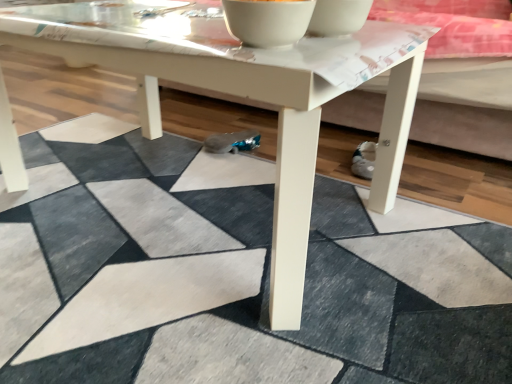
Question: From a real-world perspective, is white glossy bowl at upper center, the first bowl from the left, located higher than white glossy bowl at upper center, which ranks as the 2th bowl in left-to-right order?

Choices:
 (A) yes
 (B) no

Answer: (A)

Question: Is white glossy bowl at upper center, the first bowl from the left, wider than white glossy bowl at upper center, which ranks as the 2th bowl in left-to-right order?

Choices:
 (A) no
 (B) yes

Answer: (B)

Question: Is white glossy bowl at upper center, acting as the second bowl starting from the right, oriented away from white glossy bowl at upper center, the first bowl in the right-to-left sequence?

Choices:
 (A) yes
 (B) no

Answer: (B)

Question: Is white glossy bowl at upper center, acting as the second bowl starting from the right, positioned before white glossy bowl at upper center, the first bowl in the right-to-left sequence?

Choices:
 (A) yes
 (B) no

Answer: (A)

Question: Is white glossy bowl at upper center, acting as the second bowl starting from the right, shorter than white glossy bowl at upper center, which ranks as the 2th bowl in left-to-right order?

Choices:
 (A) yes
 (B) no

Answer: (B)

Question: Considering the relative positions of white glossy bowl at upper center, acting as the second bowl starting from the right, and white glossy bowl at upper center, which ranks as the 2th bowl in left-to-right order, in the image provided, is white glossy bowl at upper center, acting as the second bowl starting from the right, to the left of white glossy bowl at upper center, which ranks as the 2th bowl in left-to-right order, from the viewer's perspective?

Choices:
 (A) no
 (B) yes

Answer: (B)

Question: Is white glossy bowl at upper center, acting as the second bowl starting from the right, located within white glossy bowl at upper center, the first bowl in the right-to-left sequence?

Choices:
 (A) no
 (B) yes

Answer: (A)

Question: Does white glossy bowl at upper center, the first bowl in the right-to-left sequence, have a lesser width compared to white glossy bowl at upper center, acting as the second bowl starting from the right?

Choices:
 (A) yes
 (B) no

Answer: (A)

Question: From the image's perspective, is white glossy bowl at upper center, which ranks as the 2th bowl in left-to-right order, below white glossy bowl at upper center, acting as the second bowl starting from the right?

Choices:
 (A) no
 (B) yes

Answer: (A)

Question: Can you confirm if white glossy bowl at upper center, which ranks as the 2th bowl in left-to-right order, is positioned to the left of white glossy bowl at upper center, the first bowl from the left?

Choices:
 (A) no
 (B) yes

Answer: (A)

Question: From a real-world perspective, is white glossy bowl at upper center, the first bowl in the right-to-left sequence, on top of white glossy bowl at upper center, acting as the second bowl starting from the right?

Choices:
 (A) yes
 (B) no

Answer: (B)

Question: From a real-world perspective, is white glossy bowl at upper center, which ranks as the 2th bowl in left-to-right order, positioned under white glossy bowl at upper center, acting as the second bowl starting from the right, based on gravity?

Choices:
 (A) yes
 (B) no

Answer: (A)

Question: Is white matte coffee table at center wider than white glossy bowl at upper center, the first bowl from the left?

Choices:
 (A) yes
 (B) no

Answer: (A)